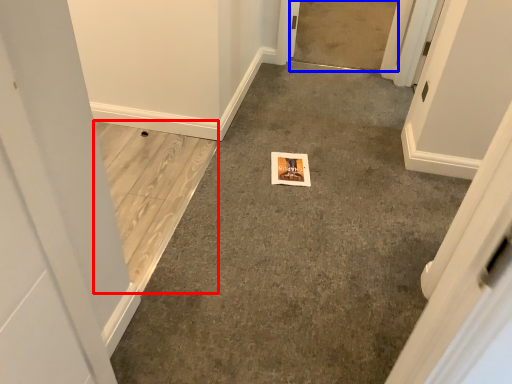
Question: Which object appears closest to the camera in this image, concrete (highlighted by a red box) or concrete (highlighted by a blue box)?

Choices:
 (A) concrete
 (B) concrete

Answer: (A)